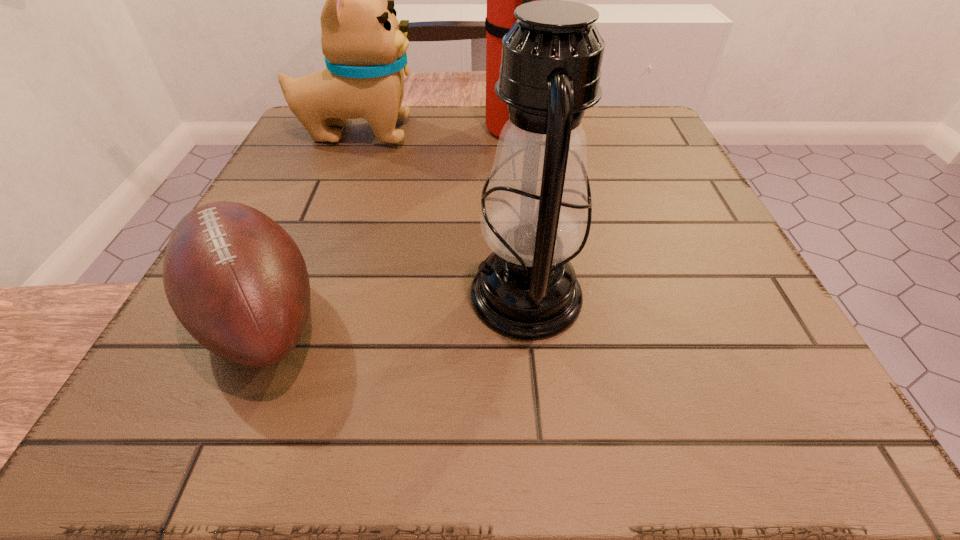
Where is `free space that satisfies the following two spatial constraints: 1. on the face of the puppy; 2. on the left side of the oil lamp`? This screenshot has width=960, height=540. free space that satisfies the following two spatial constraints: 1. on the face of the puppy; 2. on the left side of the oil lamp is located at coordinates (294, 295).